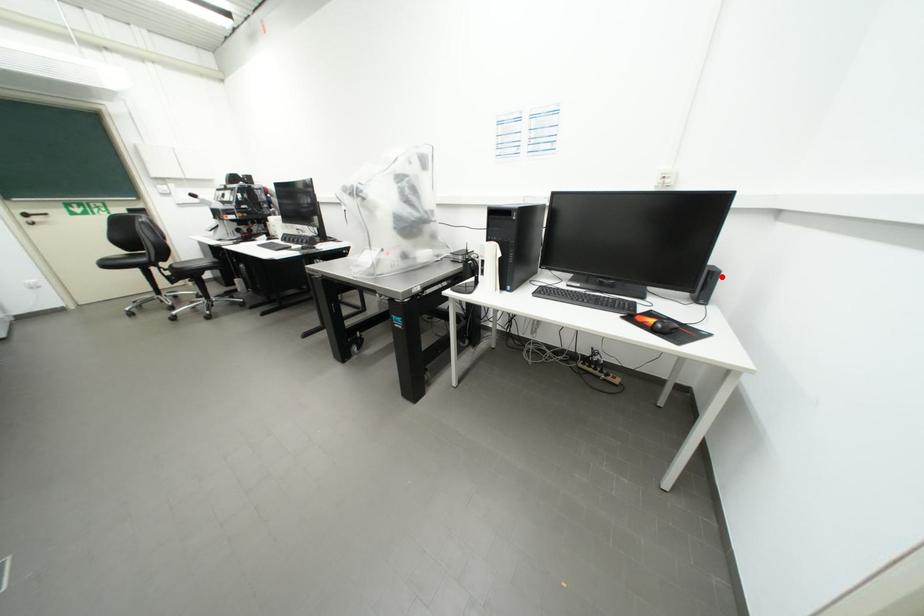
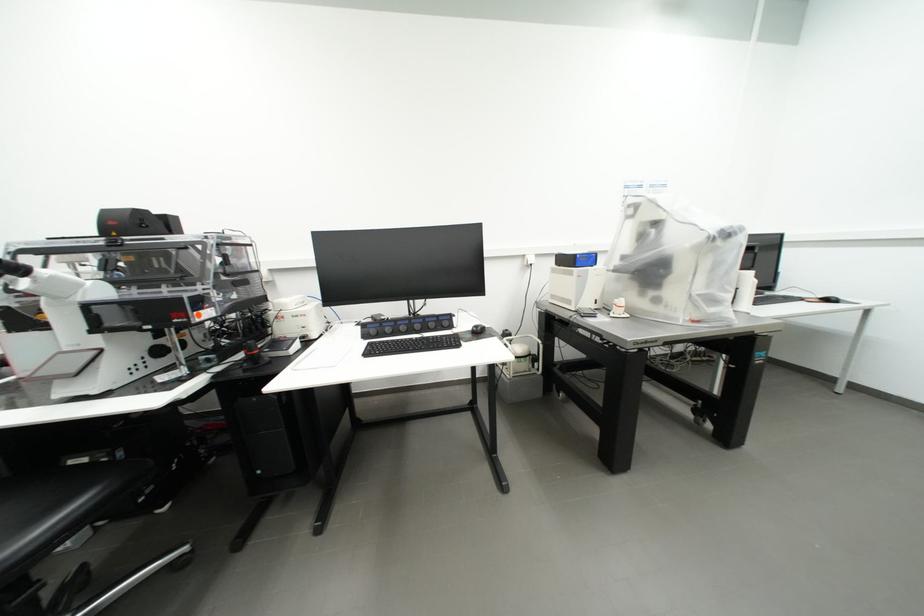
Question: I am providing you with two images of the same scene from different viewpoints. A red point is marked on the first image. Is the red point's position out of view in image 2?

Choices:
 (A) Yes
 (B) No

Answer: (A)